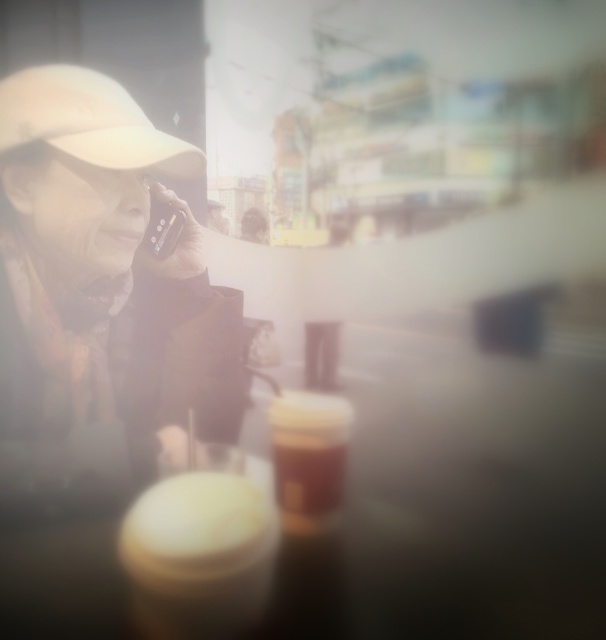
Measure the distance between matte beige cap at left and translucent plastic cup at lower center.

10.71 inches

Does matte beige cap at left have a larger size compared to translucent plastic cup at lower center?

Indeed, matte beige cap at left has a larger size compared to translucent plastic cup at lower center.

Between point (110, 355) and point (281, 518), which one is positioned behind?

Positioned behind is point (110, 355).

You are a GUI agent. You are given a task and a screenshot of the screen. Output one action in this format:
    pyautogui.click(x=<x>, y=<y>)
    Task: Click on the matte beige cap at left
    
    Given the screenshot: What is the action you would take?
    pyautogui.click(x=98, y=296)

Who is lower down, translucent plastic cup at lower center or matte black phone at upper left?

translucent plastic cup at lower center is lower down.

Between translucent plastic cup at lower center and matte black phone at upper left, which one appears on the right side from the viewer's perspective?

translucent plastic cup at lower center is more to the right.

Is point (318, 429) behind point (171, 220)?

No, it is in front of (171, 220).

Locate an element on the screen. The height and width of the screenshot is (640, 606). translucent plastic cup at lower center is located at coordinates (308, 456).

Does matte beige cap at left have a greater width compared to beige fabric baseball hat at upper left?

Correct, the width of matte beige cap at left exceeds that of beige fabric baseball hat at upper left.

Locate an element on the screen. matte beige cap at left is located at coordinates click(98, 296).

The image size is (606, 640). Identify the location of matte beige cap at left. (98, 296).